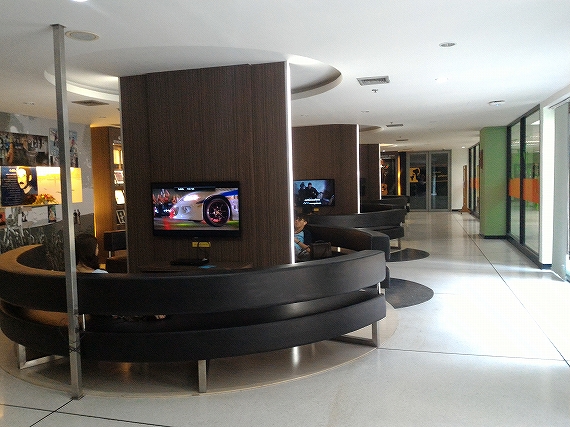
This screenshot has width=570, height=427. Identify the location of tv scree. (171, 198), (215, 199), (321, 190), (308, 191), (223, 219), (186, 218).